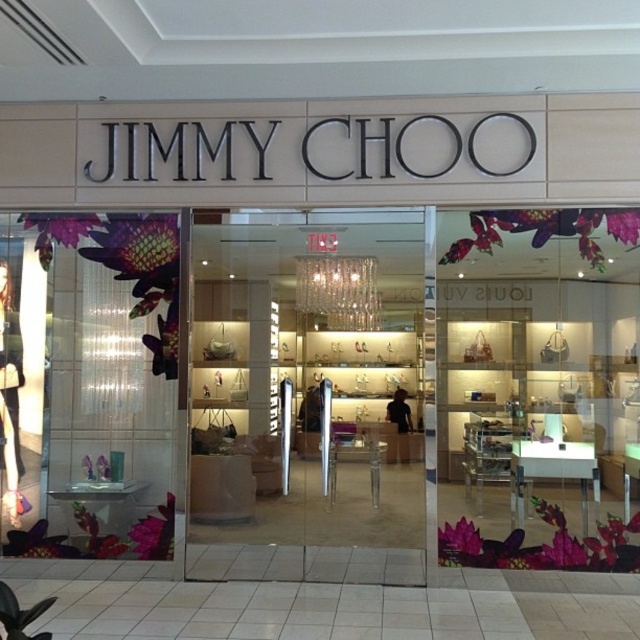
Question: Is transparent glass door at center wider than translucent glass vase at left?

Choices:
 (A) yes
 (B) no

Answer: (B)

Question: Does transparent glass door at center have a greater width compared to translucent glass vase at left?

Choices:
 (A) no
 (B) yes

Answer: (A)

Question: Among these objects, which one is farthest from the camera?

Choices:
 (A) translucent glass vase at left
 (B) transparent glass door at center

Answer: (B)

Question: Is transparent glass door at center below translucent glass vase at left?

Choices:
 (A) yes
 (B) no

Answer: (A)

Question: Which of the following is the farthest from the observer?

Choices:
 (A) (100, 284)
 (B) (208, 401)

Answer: (B)